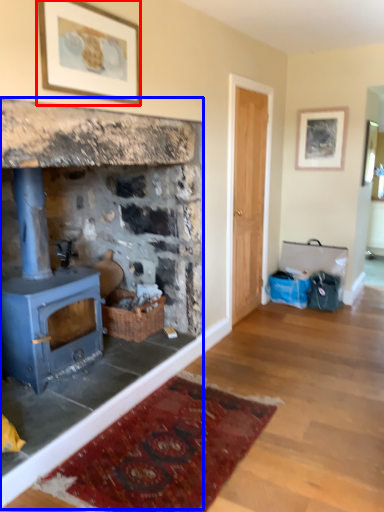
Question: Among these objects, which one is nearest to the camera, picture frame (highlighted by a red box) or fireplace (highlighted by a blue box)?

Choices:
 (A) picture frame
 (B) fireplace

Answer: (B)